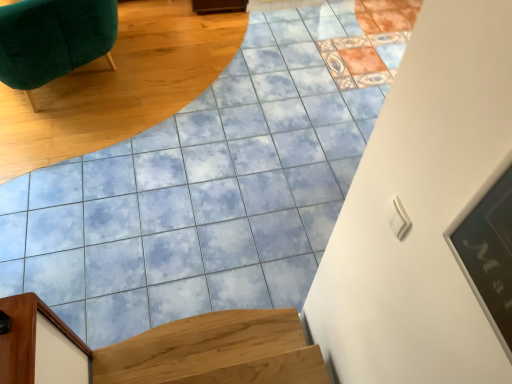
The width and height of the screenshot is (512, 384). Identify the location of vacant space underneath velvet green chair at upper left, the 2th furniture positioned from the right (from a real-world perspective). (71, 88).